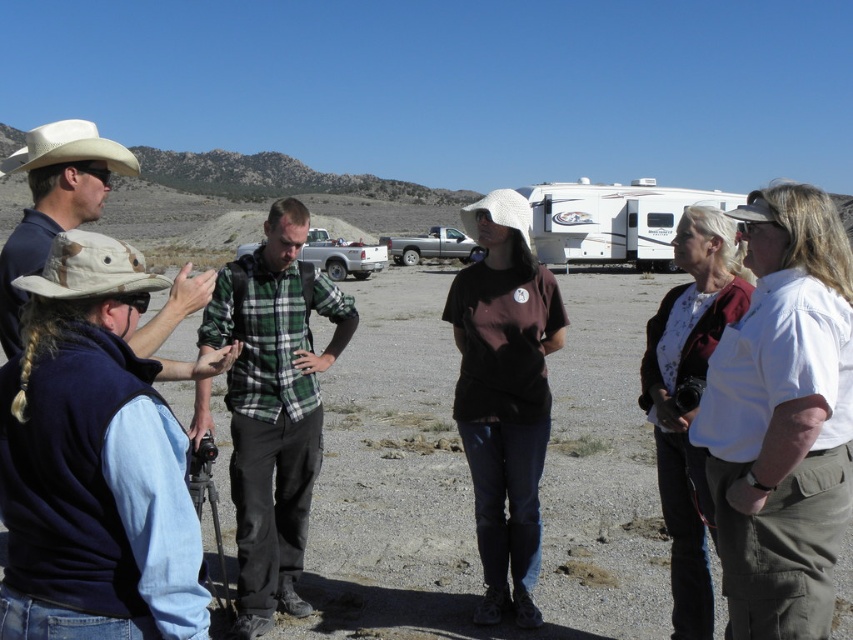
Question: Does white glossy recreational vehicle at center-right have a larger size compared to silver metallic truck at center?

Choices:
 (A) yes
 (B) no

Answer: (A)

Question: Can you confirm if camouflage fabric cowboy hat at left is bigger than white felt cowboy hat at left?

Choices:
 (A) yes
 (B) no

Answer: (B)

Question: Which is farther from the white glossy recreational vehicle at center-right?

Choices:
 (A) camouflage fabric cowboy hat at left
 (B) white cotton shirt at right
 (C) white plastic truck at center

Answer: (A)

Question: Among these objects, which one is nearest to the camera?

Choices:
 (A) white glossy recreational vehicle at center-right
 (B) green plaid shirt at center
 (C) white plastic truck at center
 (D) silver metallic truck at center

Answer: (B)

Question: Among these points, which one is farthest from the camera?

Choices:
 (A) (839, 336)
 (B) (416, 236)

Answer: (B)

Question: Where is white glossy recreational vehicle at center-right located in relation to camouflage fabric cowboy hat at left in the image?

Choices:
 (A) below
 (B) above

Answer: (B)